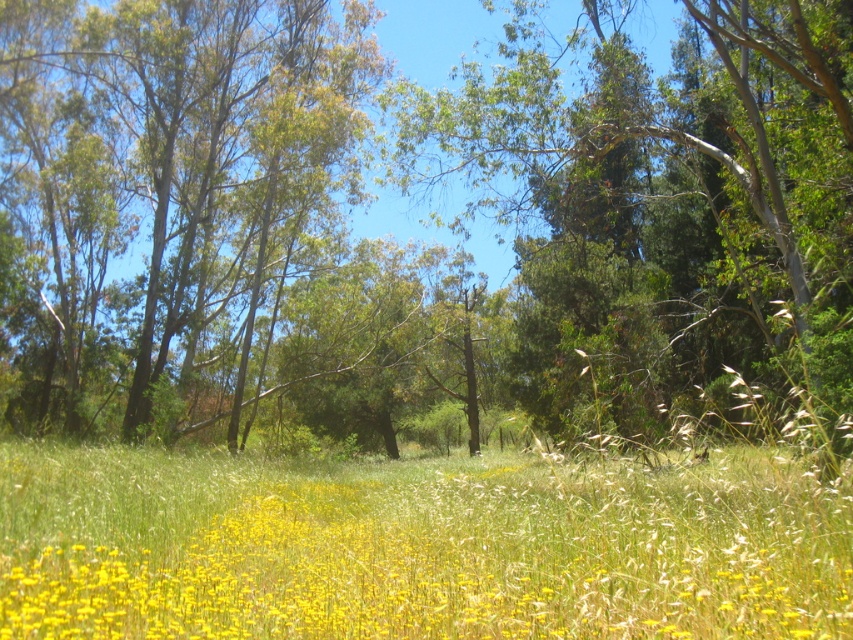
Is point (476, 81) closer to viewer compared to point (80, 54)?

Yes, it is in front of point (80, 54).

I want to click on green leafy tree at center, so click(x=410, y=192).

Is point (253, 552) farther from camera compared to point (151, 250)?

No.

Is yellow grass at lower center further to the viewer compared to green leafy tree at upper left?

That is False.

Does point (53, 531) lie in front of point (210, 227)?

That is True.

You are a GUI agent. You are given a task and a screenshot of the screen. Output one action in this format:
    pyautogui.click(x=<x>, y=<y>)
    Task: Click on the yellow grass at lower center
    This screenshot has height=640, width=853.
    Given the screenshot: What is the action you would take?
    pyautogui.click(x=419, y=552)

Who is positioned more to the left, green leafy tree at center or yellow grass at lower center?

green leafy tree at center

Is green leafy tree at center positioned in front of yellow grass at lower center?

No, green leafy tree at center is further to the viewer.

Between point (721, 115) and point (161, 557), which one is positioned in front?

Positioned in front is point (161, 557).

You are a GUI agent. You are given a task and a screenshot of the screen. Output one action in this format:
    pyautogui.click(x=<x>, y=<y>)
    Task: Click on the green leafy tree at center
    The height and width of the screenshot is (640, 853).
    Given the screenshot: What is the action you would take?
    pyautogui.click(x=410, y=192)